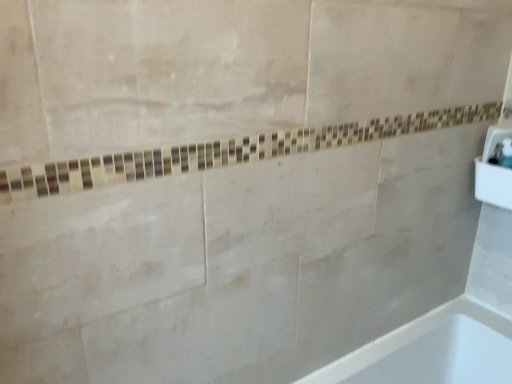
Question: Should I look upward or downward to see white glossy sink at right?

Choices:
 (A) down
 (B) up

Answer: (B)